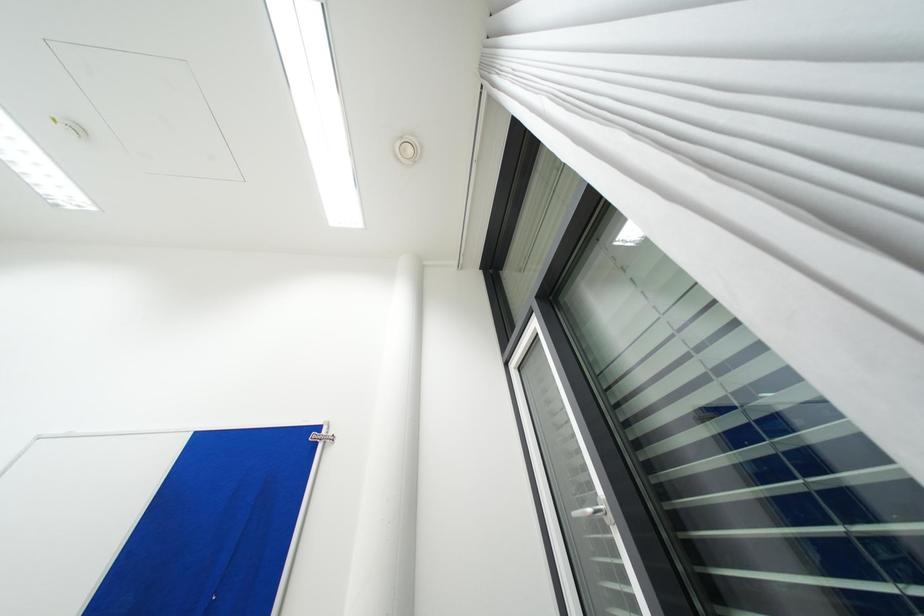
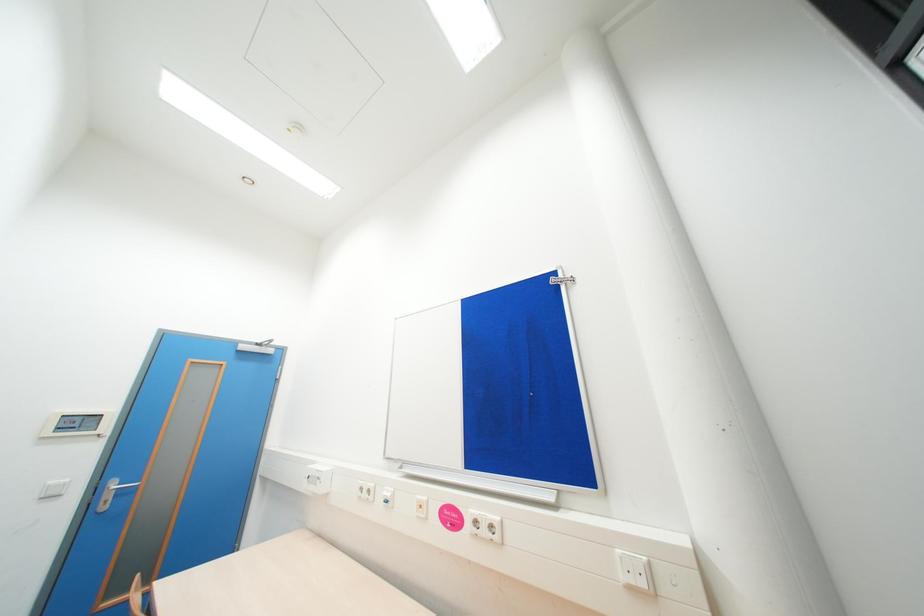
Question: The camera is either moving clockwise (left) or counter-clockwise (right) around the object. The first image is from the beginning of the video and the second image is from the end. Is the camera moving left or right when shooting the video?

Choices:
 (A) Left
 (B) Right

Answer: (B)